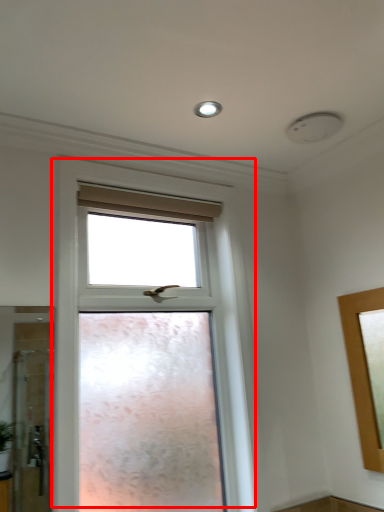
Question: From the image's perspective, what is the correct spatial positioning of window (annotated by the red box) in reference to lighting?

Choices:
 (A) above
 (B) below

Answer: (B)